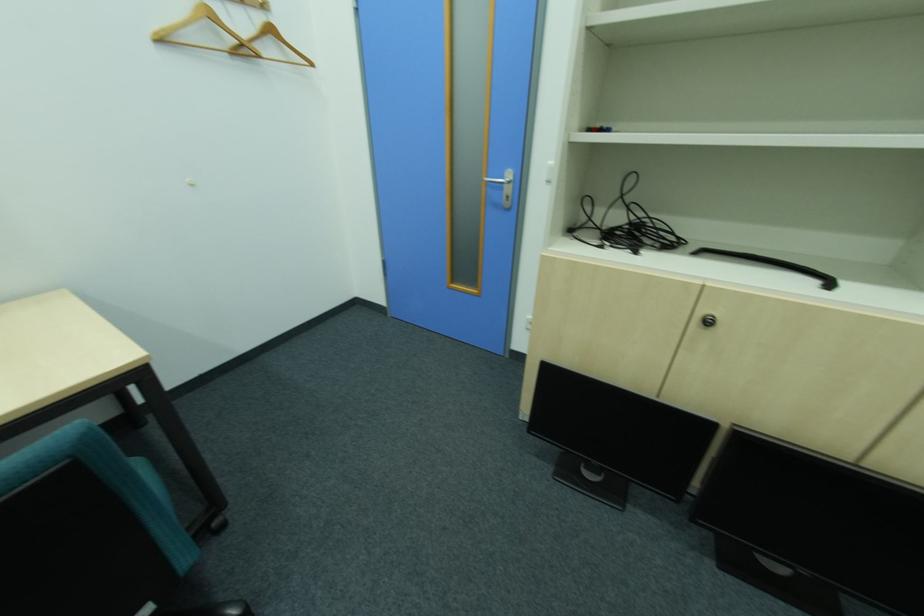
Locate an element on the screen. The width and height of the screenshot is (924, 616). silver door handle is located at coordinates (501, 179).